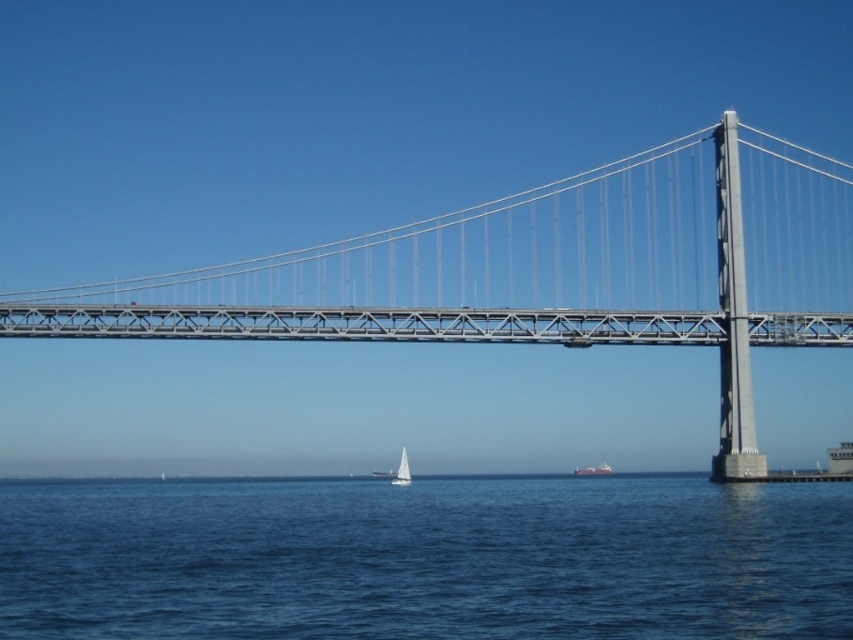
Is point (111, 608) closer to viewer compared to point (579, 468)?

Yes, it is.

Between blue water at center and brown matte cargo ship at center, which one appears on the left side from the viewer's perspective?

blue water at center

Between point (683, 592) and point (601, 472), which one is positioned behind?

Point (601, 472)

I want to click on blue water at center, so click(x=426, y=560).

Which is above, blue water at center or white matte sailboat at center?

blue water at center is higher up.

Where is `blue water at center`? blue water at center is located at coordinates (426, 560).

The height and width of the screenshot is (640, 853). Find the location of `blue water at center`. blue water at center is located at coordinates (426, 560).

The image size is (853, 640). What are the coordinates of `blue water at center` in the screenshot? It's located at (426, 560).

Between point (335, 596) and point (654, 192), which one is positioned behind?

The point (654, 192) is behind.

Which is below, blue water at center or metallic gray suspension bridge at center?

blue water at center is lower down.

The height and width of the screenshot is (640, 853). What do you see at coordinates (426, 560) in the screenshot?
I see `blue water at center` at bounding box center [426, 560].

Where is `blue water at center`? blue water at center is located at coordinates (426, 560).